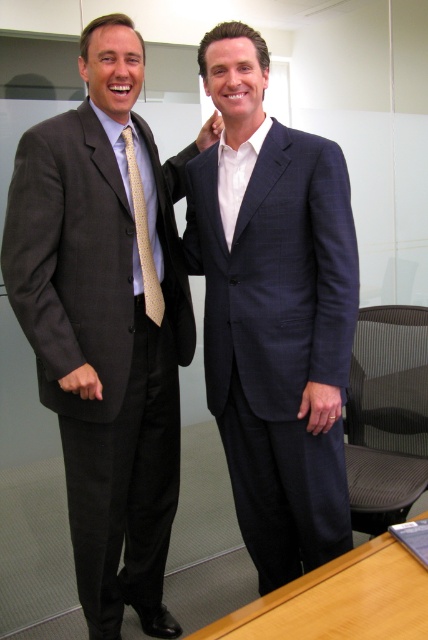
Question: Is matte black suit at left to the left of gold textured tie at left from the viewer's perspective?

Choices:
 (A) yes
 (B) no

Answer: (A)

Question: Which of these objects is positioned farthest from the navy textured suit at center?

Choices:
 (A) matte black suit at left
 (B) gold textured tie at left

Answer: (B)

Question: Which of the following is the closest to the observer?

Choices:
 (A) (309, 346)
 (B) (130, 509)
 (C) (146, 212)

Answer: (A)

Question: Among these objects, which one is farthest from the camera?

Choices:
 (A) matte black suit at left
 (B) navy textured suit at center
 (C) gold textured tie at left

Answer: (C)

Question: Is matte black suit at left below navy textured suit at center?

Choices:
 (A) yes
 (B) no

Answer: (A)

Question: Can you confirm if matte black suit at left is bigger than navy textured suit at center?

Choices:
 (A) no
 (B) yes

Answer: (B)